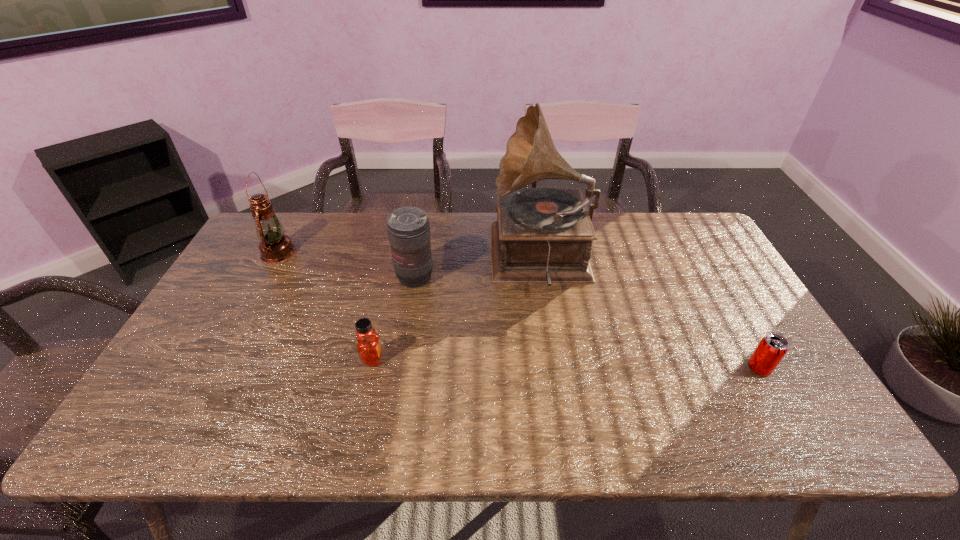
Identify the location of the tallest object. This screenshot has width=960, height=540. (542, 235).

Locate an element on the screen. The image size is (960, 540). record player is located at coordinates (542, 235).

Find the location of a particular element. oil lamp is located at coordinates (275, 247).

Find the location of a particular element. the leftmost object is located at coordinates (275, 247).

In order to click on the third tallest object in this screenshot , I will do `click(408, 228)`.

Locate an element on the screen. honey is located at coordinates (368, 345).

The image size is (960, 540). I want to click on soda can, so click(x=772, y=348).

Image resolution: width=960 pixels, height=540 pixels. Find the location of `the shortest object`. the shortest object is located at coordinates (772, 348).

Where is `free region located from the horn of the fourth object from left to right`? The image size is (960, 540). free region located from the horn of the fourth object from left to right is located at coordinates (382, 258).

You are a GUI agent. You are given a task and a screenshot of the screen. Output one action in this format:
    pyautogui.click(x=<x>, y=<y>)
    Task: Click on the free point located 0.160m from the horn of the fourth object from left to right
    
    Given the screenshot: What is the action you would take?
    pyautogui.click(x=442, y=258)